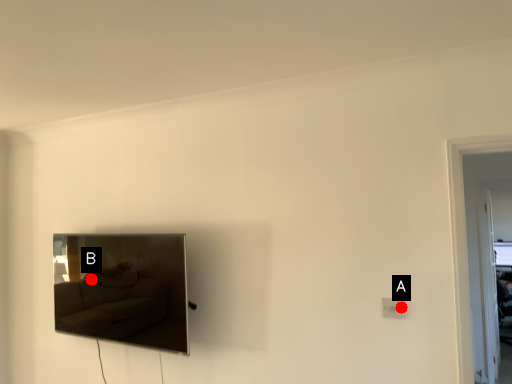
Question: Two points are circled on the image, labeled by A and B beside each circle. Which point is closer to the camera?

Choices:
 (A) A is closer
 (B) B is closer

Answer: (A)